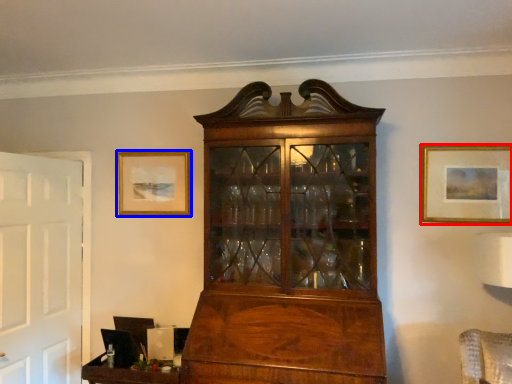
Question: Among these objects, which one is nearest to the camera, picture frame (highlighted by a red box) or picture frame (highlighted by a blue box)?

Choices:
 (A) picture frame
 (B) picture frame

Answer: (A)